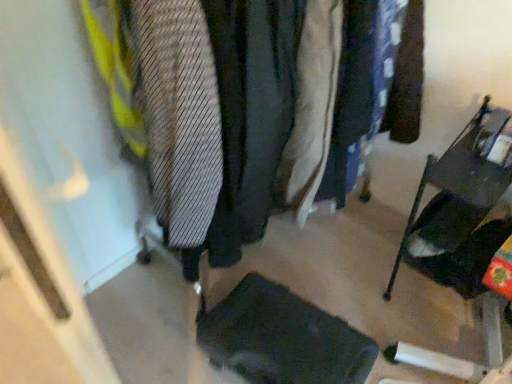
Question: Does light beige fabric coat at center contain black fabric footrest at lower center?

Choices:
 (A) no
 (B) yes

Answer: (A)

Question: Would you say light beige fabric coat at center is outside black fabric footrest at lower center?

Choices:
 (A) yes
 (B) no

Answer: (A)

Question: Does light beige fabric coat at center have a greater height compared to black fabric footrest at lower center?

Choices:
 (A) no
 (B) yes

Answer: (B)

Question: Can you confirm if light beige fabric coat at center is positioned to the right of black fabric footrest at lower center?

Choices:
 (A) yes
 (B) no

Answer: (A)

Question: From a real-world perspective, is light beige fabric coat at center over black fabric footrest at lower center?

Choices:
 (A) yes
 (B) no

Answer: (A)

Question: Considering their positions, is striped fabric tie at left located in front of or behind light beige fabric coat at center?

Choices:
 (A) front
 (B) behind

Answer: (A)

Question: Does point (173, 147) appear closer or farther from the camera than point (291, 195)?

Choices:
 (A) closer
 (B) farther

Answer: (A)

Question: Visually, is striped fabric tie at left positioned to the left or to the right of light beige fabric coat at center?

Choices:
 (A) left
 (B) right

Answer: (A)

Question: From a real-world perspective, is striped fabric tie at left physically located above or below light beige fabric coat at center?

Choices:
 (A) above
 (B) below

Answer: (A)

Question: From their relative heights in the image, would you say light beige fabric coat at center is taller or shorter than metallic dark gray folding chair at right?

Choices:
 (A) tall
 (B) short

Answer: (A)

Question: From a real-world perspective, is light beige fabric coat at center positioned above or below metallic dark gray folding chair at right?

Choices:
 (A) above
 (B) below

Answer: (A)

Question: Looking at their shapes, would you say light beige fabric coat at center is wider or thinner than metallic dark gray folding chair at right?

Choices:
 (A) thin
 (B) wide

Answer: (A)

Question: Does point (280, 168) appear closer or farther from the camera than point (420, 350)?

Choices:
 (A) closer
 (B) farther

Answer: (B)

Question: Is black fabric footrest at lower center bigger or smaller than metallic dark gray folding chair at right?

Choices:
 (A) small
 (B) big

Answer: (A)

Question: Is black fabric footrest at lower center in front of or behind metallic dark gray folding chair at right in the image?

Choices:
 (A) front
 (B) behind

Answer: (B)